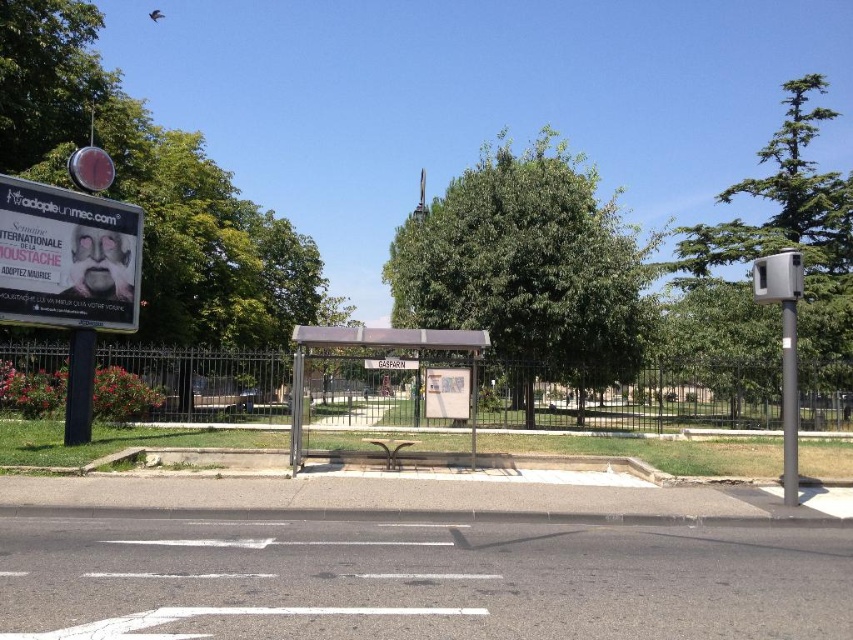
Question: Which point appears farthest from the camera in this image?

Choices:
 (A) (415, 360)
 (B) (398, 333)
 (C) (798, 298)
 (D) (422, 246)

Answer: (D)

Question: Which point appears farthest from the camera in this image?

Choices:
 (A) (782, 296)
 (B) (538, 307)
 (C) (457, 368)
 (D) (442, 330)

Answer: (B)

Question: Based on their relative distances, which object is nearer to the green leafy tree at upper center?

Choices:
 (A) metallic bus stop at center
 (B) matte digital billboard at upper left
 (C) white plastic sign at center

Answer: (B)

Question: Is black metal fence at center above green leafy tree at right?

Choices:
 (A) no
 (B) yes

Answer: (A)

Question: Can you confirm if green leafy tree at upper center is smaller than metallic bus stop at center?

Choices:
 (A) yes
 (B) no

Answer: (B)

Question: Is green leafy tree at center below matte digital billboard at upper left?

Choices:
 (A) yes
 (B) no

Answer: (B)